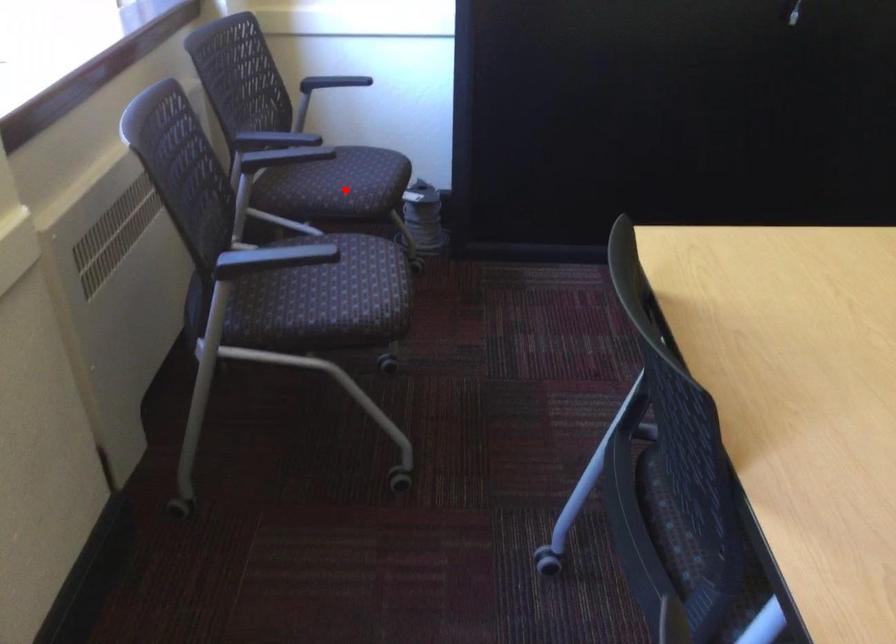
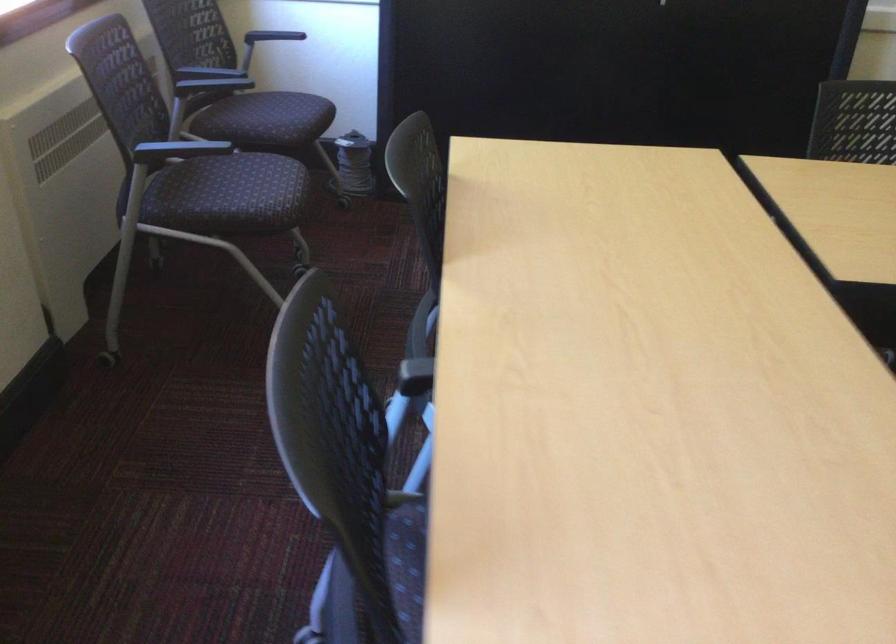
Question: I am providing you with two images of the same scene from different viewpoints. A red point is shown in image1. For the corresponding object point in image2, is it positioned nearer or farther from the camera?

Choices:
 (A) Nearer
 (B) Farther

Answer: (B)